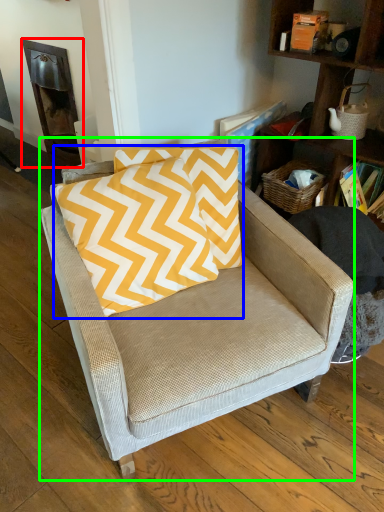
Question: Estimate the real-world distances between objects in this image. Which object is farther from fireplace (highlighted by a red box), pillow (highlighted by a blue box) or chair (highlighted by a green box)?

Choices:
 (A) pillow
 (B) chair

Answer: (B)